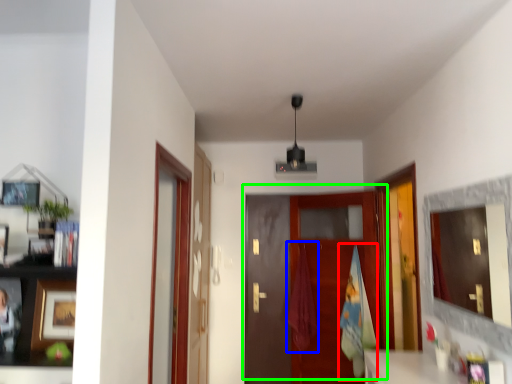
Question: Based on their relative distances, which object is nearer to bath towel (highlighted by a red box)? Choose from laundry (highlighted by a blue box) and door (highlighted by a green box).

Choices:
 (A) laundry
 (B) door

Answer: (B)